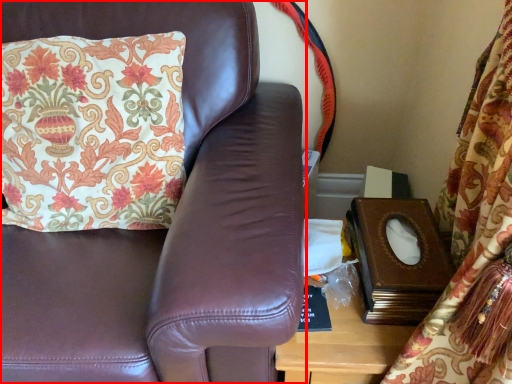
Question: From the image's perspective, where is furniture (annotated by the red box) located in relation to pillow in the image?

Choices:
 (A) above
 (B) below

Answer: (B)